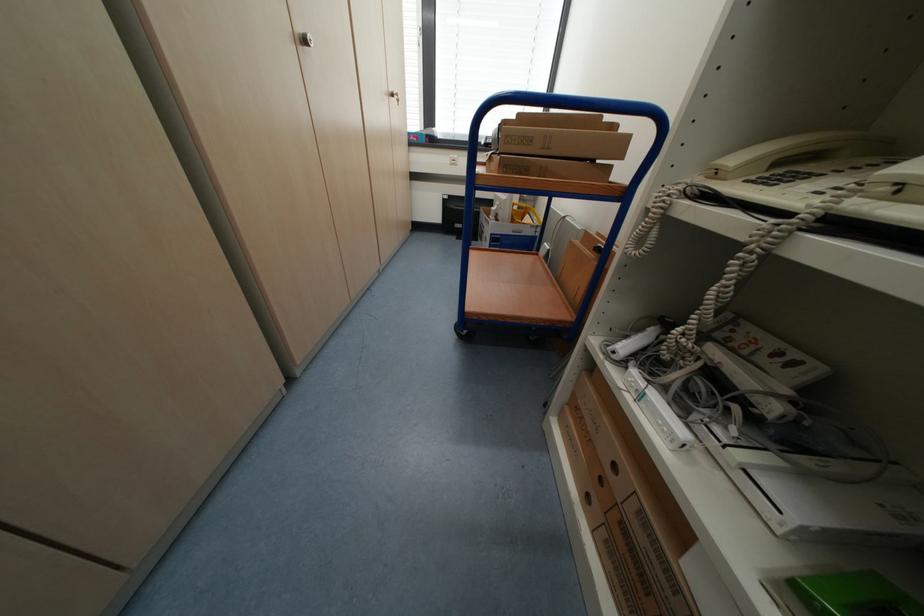
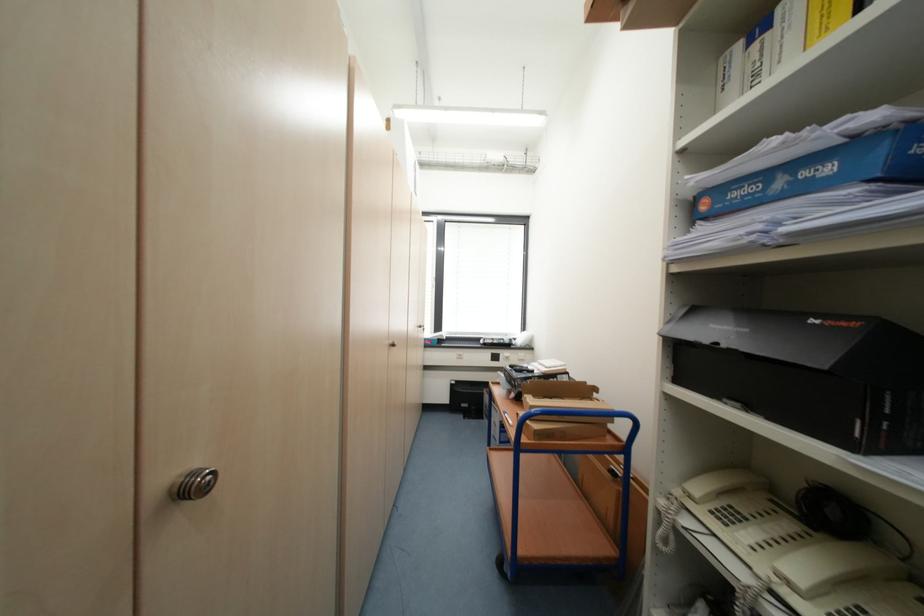
The point at (772, 176) is marked in the first image. Where is the corresponding point in the second image?

(723, 507)